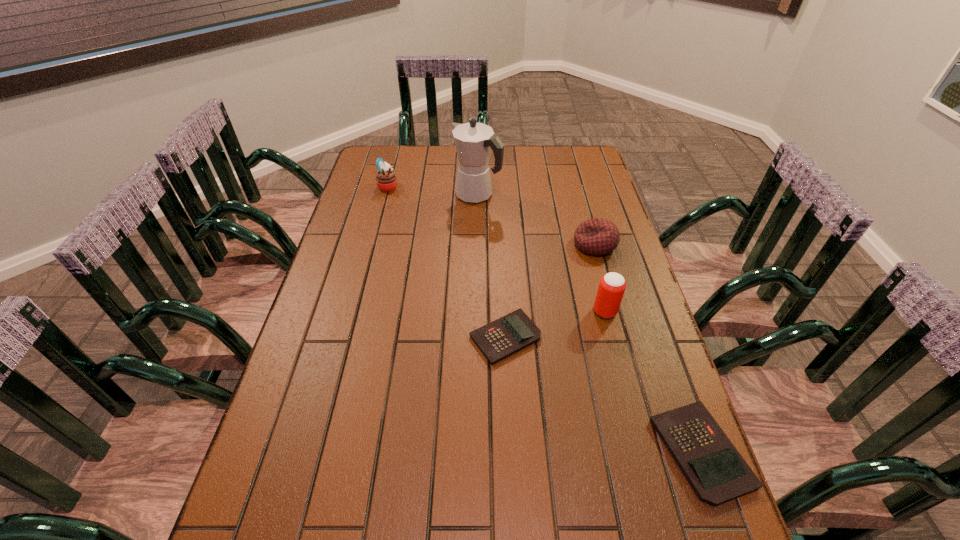
The width and height of the screenshot is (960, 540). In order to click on the shortest object in this screenshot , I will do `click(497, 340)`.

The height and width of the screenshot is (540, 960). Find the location of `the shorter calculator`. the shorter calculator is located at coordinates (497, 340).

Find the location of a particular element. The width and height of the screenshot is (960, 540). the nearest object is located at coordinates (716, 471).

Identify the location of the taller calculator. This screenshot has width=960, height=540. click(716, 471).

You are a GUI agent. You are given a task and a screenshot of the screen. Output one action in this format:
    pyautogui.click(x=<x>, y=<y>)
    Task: Click on the tallest object
    The width and height of the screenshot is (960, 540).
    Given the screenshot: What is the action you would take?
    pyautogui.click(x=473, y=141)

Locate an element on the screen. muffin is located at coordinates (386, 180).

You are a GUI agent. You are given a task and a screenshot of the screen. Output one action in this format:
    pyautogui.click(x=<x>, y=<y>)
    Task: Click on the beer can
    This screenshot has height=540, width=960.
    Given the screenshot: What is the action you would take?
    tap(612, 285)

Find the location of a particular element. beanbag is located at coordinates (597, 236).

The width and height of the screenshot is (960, 540). I want to click on the fourth tallest object, so click(597, 236).

The image size is (960, 540). What are the coordinates of `free space located on the back of the farther calculator` in the screenshot? It's located at (502, 285).